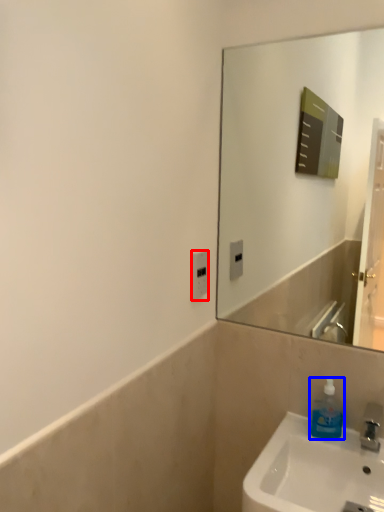
Question: Among these objects, which one is nearest to the camera, electric outlet (highlighted by a red box) or soap dispenser (highlighted by a blue box)?

Choices:
 (A) electric outlet
 (B) soap dispenser

Answer: (B)